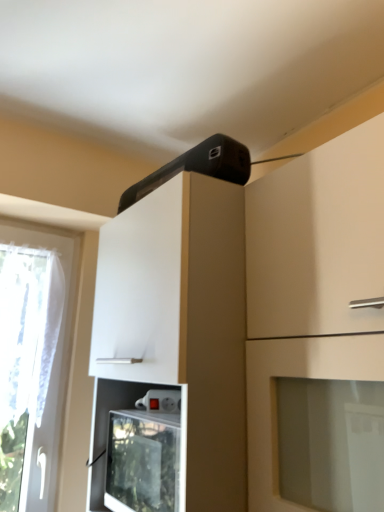
Question: Considering the positions of black plastic speaker at upper center and white glossy cabinet at upper center, the second cabinetry in the left-to-right sequence, in the image, is black plastic speaker at upper center wider or thinner than white glossy cabinet at upper center, the second cabinetry in the left-to-right sequence,?

Choices:
 (A) wide
 (B) thin

Answer: (B)

Question: From their relative heights in the image, would you say black plastic speaker at upper center is taller or shorter than white glossy cabinet at upper center, the second cabinetry in the left-to-right sequence?

Choices:
 (A) short
 (B) tall

Answer: (A)

Question: Which object is positioned closest to the white glossy cabinet at upper center, the first cabinetry positioned from the left?

Choices:
 (A) white glossy cabinet at upper center, acting as the first cabinetry starting from the right
 (B) black plastic speaker at upper center

Answer: (A)

Question: Estimate the real-world distances between objects in this image. Which object is closer to the white glossy cabinet at upper center, the second cabinetry in the left-to-right sequence?

Choices:
 (A) black plastic speaker at upper center
 (B) white glossy cabinet at upper center, the second cabinetry positioned from the right

Answer: (B)